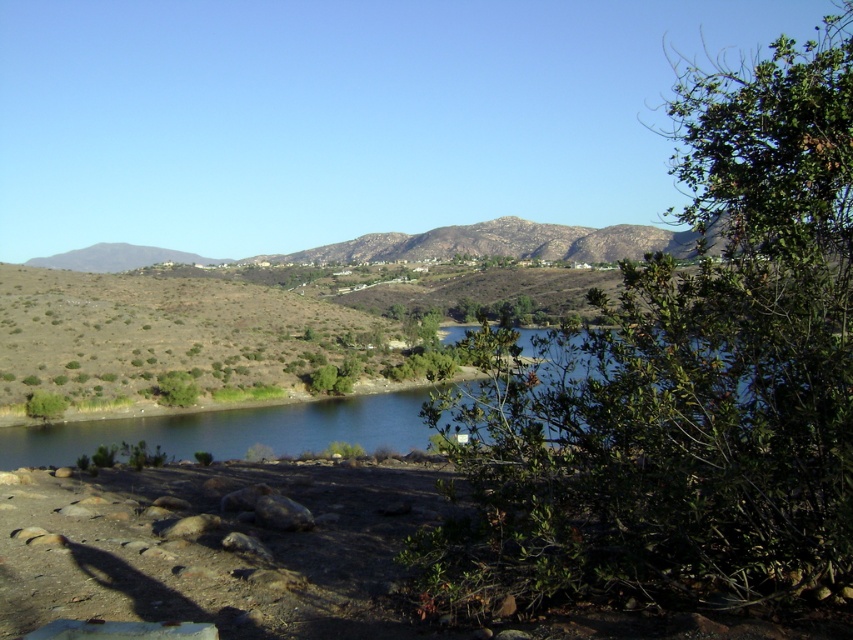
You are standing on the rocky terrain and want to reach the clear blue water at center. There is a green leafy bush at right in your path. Which direction should you move to go around the bush and still reach the water?

Since the green leafy bush at right is in front of the clear blue water at center, you should move to the left side of the bush to go around it and continue towards the water.

You are a hiker planning to cross the rocky terrain in the foreground. You notice the green leafy bush at right and the green leafy tree at lower left. Which of these two plants is taller?

The green leafy bush at right is taller than the green leafy tree at lower left.

You are a hiker who wants to take a photo of the green leafy tree at lower left without the green leafy bush at right blocking the view. Which direction should you move to ensure the tree is fully visible?

Move to the left side so that the green leafy bush at right is no longer in front of the green leafy tree at lower left.